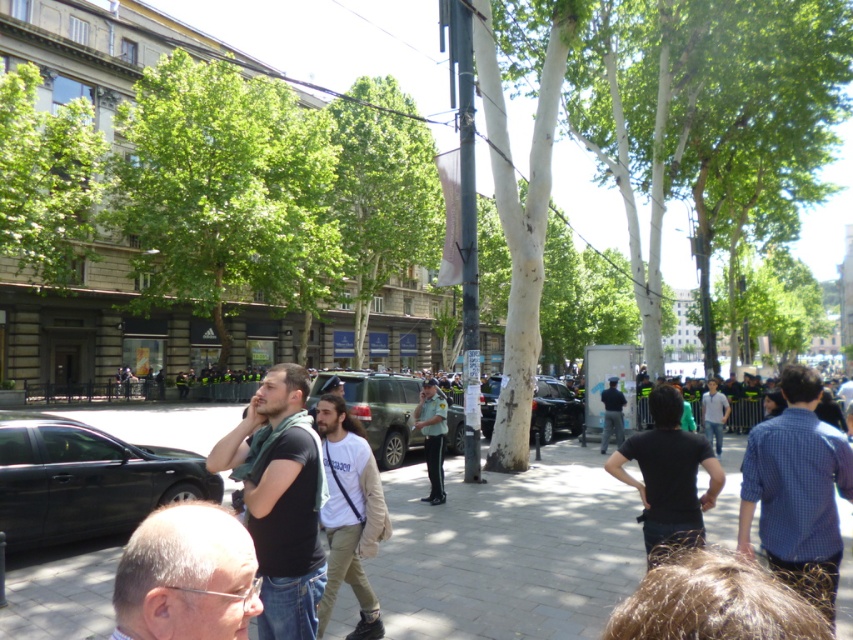
You are a delivery person who needs to hand a package to the recipient. You are currently standing 2 meters away from the black matte shirt at center. The recipient is the light brown cotton shirt at center. Can you reach them without moving closer than 1.5 meters?

The black matte shirt at center is 1.30 meters from the light brown cotton shirt at center. Since you are 2 meters away from the black matte shirt at center, your distance to the light brown cotton shirt at center would be approximately 2 meters minus 1.30 meters, which is 0.70 meters. This is less than the 1.5 meters requirement, so you would need to move back to maintain the 1.5 meters distance.

Based on the photo, you are a photographer standing in the city square and see both the black matte shirt at center and the light brown cotton shirt at center. Which one is positioned higher from the ground?

The black matte shirt at center is positioned higher from the ground than the light brown cotton shirt at center.

You are standing at the center of the scene and want to walk to the black matte car at lower left. Which direction should you move relative to the denim jeans at center?

You should move to the left of the denim jeans at center to reach the black matte car at lower left since it is located to the left of the denim jeans at center.